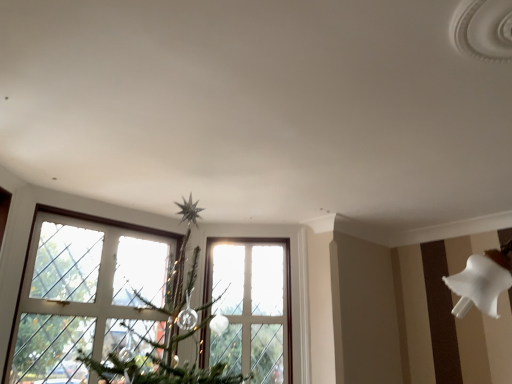
Based on the photo, in order to face white glass window at center, should I rotate leftwards or rightwards?

It's best to rotate left around 1.211 degrees.

Describe the element at coordinates (253, 306) in the screenshot. I see `white glass window at center` at that location.

The width and height of the screenshot is (512, 384). In order to click on white glass window at center in this screenshot , I will do `click(253, 306)`.

I want to click on white glass window at center, so click(x=253, y=306).